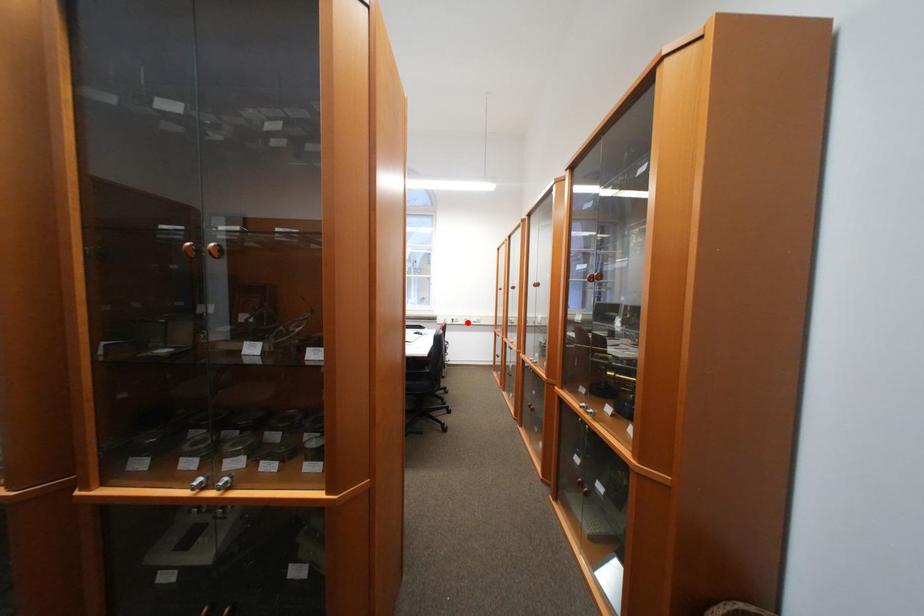
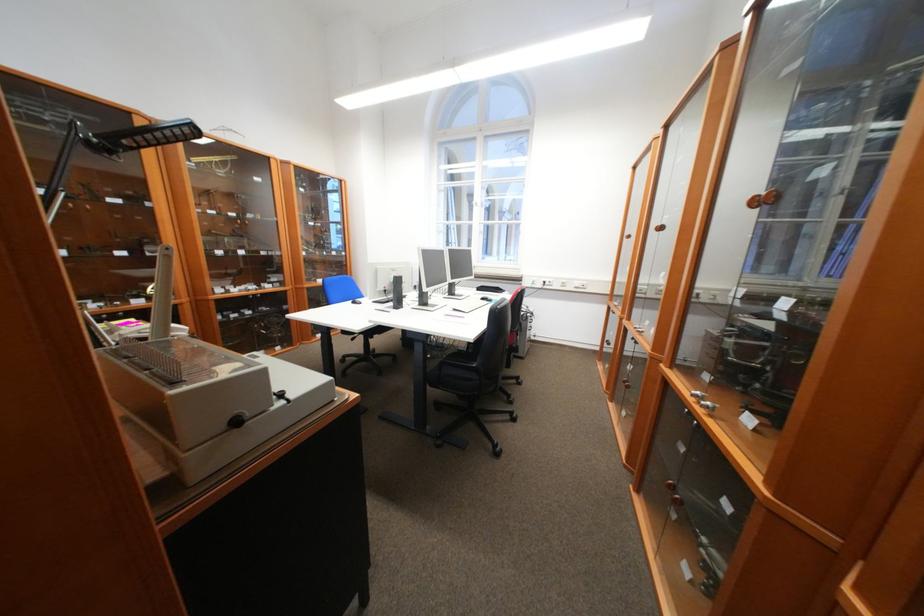
Question: A red point is marked in image1. In image2, is the corresponding 3D point closer to the camera or farther? Reply with the corresponding letter.

Choices:
 (A) The corresponding 3D point is closer.
 (B) The corresponding 3D point is farther.

Answer: (A)